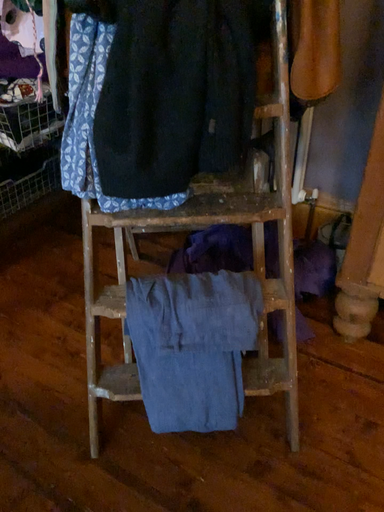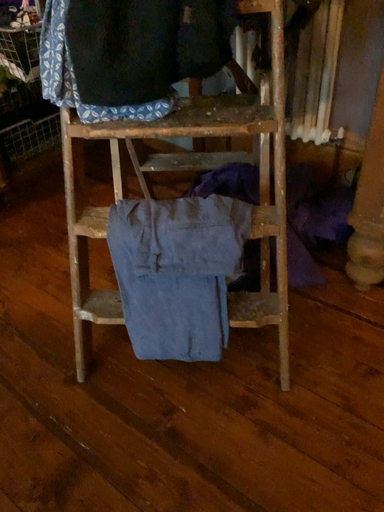
Question: Which way did the camera rotate in the video?

Choices:
 (A) rotated right
 (B) rotated left

Answer: (B)